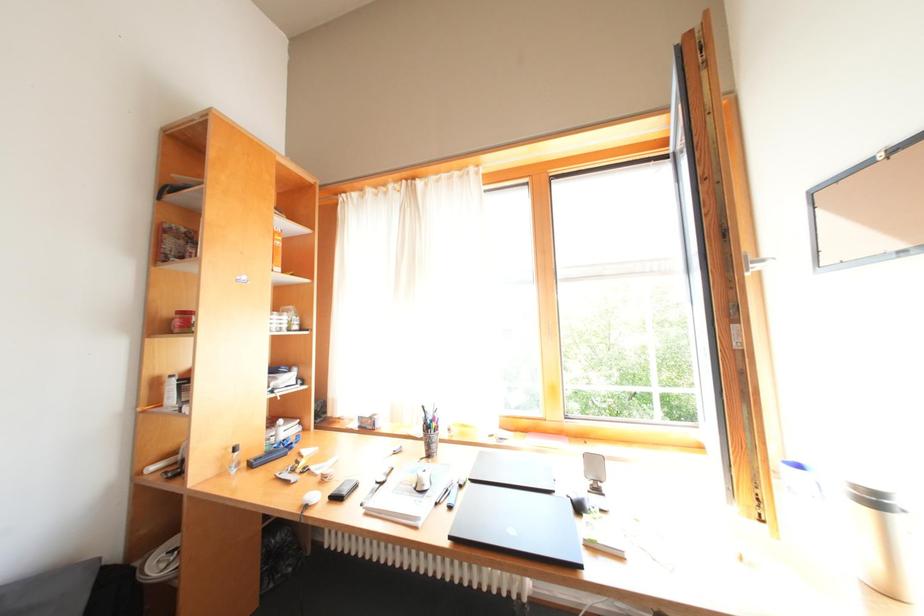
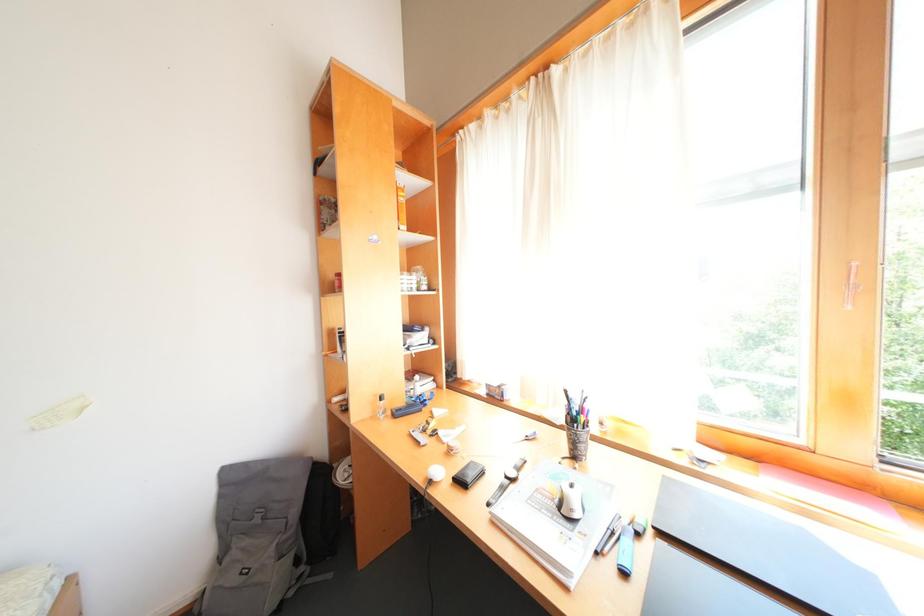
Question: The images are taken continuously from a first-person perspective. In which direction is your viewpoint rotating?

Choices:
 (A) Left
 (B) Right
 (C) Up
 (D) Down

Answer: (A)